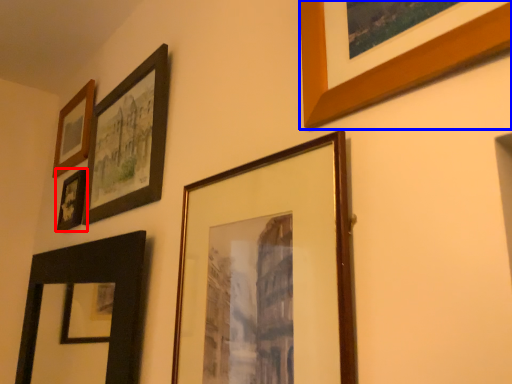
Question: Among these objects, which one is farthest to the camera, picture frame (highlighted by a red box) or picture frame (highlighted by a blue box)?

Choices:
 (A) picture frame
 (B) picture frame

Answer: (A)